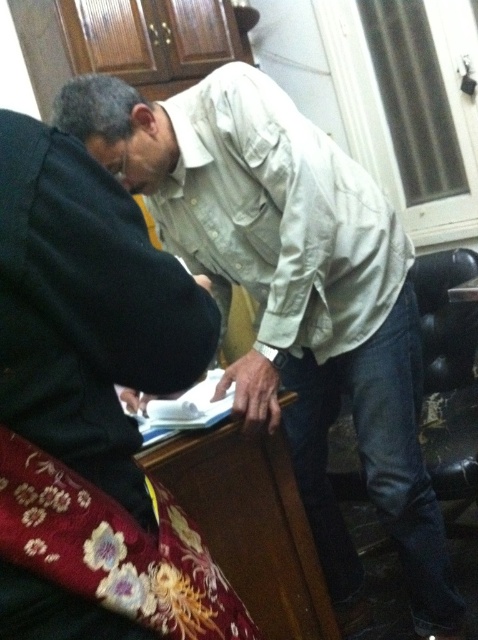
Does black matte laptop at left appear on the left side of light beige cotton shirt at center?

Correct, you'll find black matte laptop at left to the left of light beige cotton shirt at center.

Which of these two, black matte laptop at left or light beige cotton shirt at center, stands taller?

Standing taller between the two is light beige cotton shirt at center.

This screenshot has height=640, width=478. What do you see at coordinates (93, 408) in the screenshot? I see `black matte laptop at left` at bounding box center [93, 408].

What are the coordinates of `black matte laptop at left` in the screenshot? It's located at (93, 408).